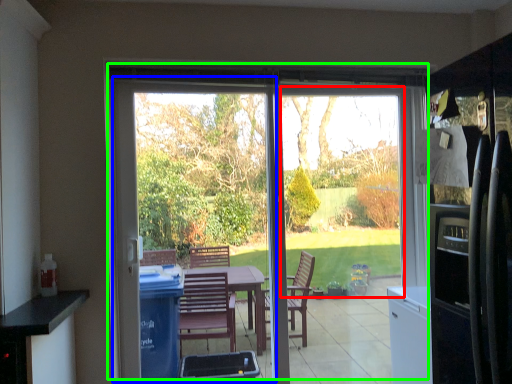
Question: Estimate the real-world distances between objects in this image. Which object is closer to window screen (highlighted by a red box), screen door (highlighted by a blue box) or door (highlighted by a green box)?

Choices:
 (A) screen door
 (B) door

Answer: (B)